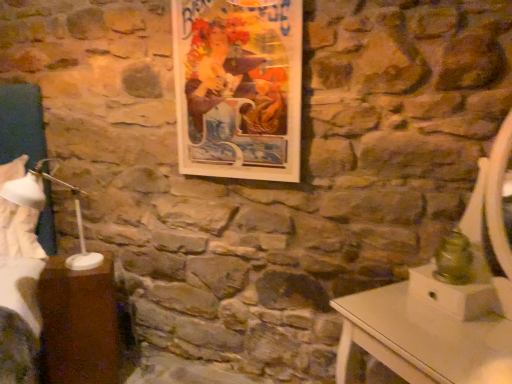
Question: Is brown wood table at lower left far from wooden picture frame at upper center?

Choices:
 (A) yes
 (B) no

Answer: (A)

Question: Is brown wood table at lower left beside wooden picture frame at upper center?

Choices:
 (A) no
 (B) yes

Answer: (A)

Question: Is brown wood table at lower left positioned beyond the bounds of wooden picture frame at upper center?

Choices:
 (A) yes
 (B) no

Answer: (A)

Question: Could wooden picture frame at upper center be considered to be inside brown wood table at lower left?

Choices:
 (A) yes
 (B) no

Answer: (B)

Question: From the image's perspective, is brown wood table at lower left located beneath wooden picture frame at upper center?

Choices:
 (A) no
 (B) yes

Answer: (B)

Question: Is wooden picture frame at upper center inside the boundaries of white plastic bedside lamp at left, or outside?

Choices:
 (A) inside
 (B) outside

Answer: (B)

Question: From their relative heights in the image, would you say wooden picture frame at upper center is taller or shorter than white plastic bedside lamp at left?

Choices:
 (A) tall
 (B) short

Answer: (A)

Question: From the image's perspective, relative to white plastic bedside lamp at left, is wooden picture frame at upper center above or below?

Choices:
 (A) above
 (B) below

Answer: (A)

Question: In terms of width, does wooden picture frame at upper center look wider or thinner when compared to white plastic bedside lamp at left?

Choices:
 (A) thin
 (B) wide

Answer: (A)

Question: Visually, is brown wood table at lower left positioned to the left or to the right of white fabric at left?

Choices:
 (A) right
 (B) left

Answer: (A)

Question: Considering the positions of brown wood table at lower left and white fabric at left in the image, is brown wood table at lower left bigger or smaller than white fabric at left?

Choices:
 (A) big
 (B) small

Answer: (B)

Question: From a real-world perspective, is brown wood table at lower left above or below white fabric at left?

Choices:
 (A) above
 (B) below

Answer: (B)

Question: Is brown wood table at lower left inside or outside of white fabric at left?

Choices:
 (A) inside
 (B) outside

Answer: (B)

Question: Is point (0, 195) positioned closer to the camera than point (237, 162)?

Choices:
 (A) closer
 (B) farther

Answer: (B)

Question: Considering their positions, is white fabric at left located in front of or behind wooden picture frame at upper center?

Choices:
 (A) front
 (B) behind

Answer: (B)